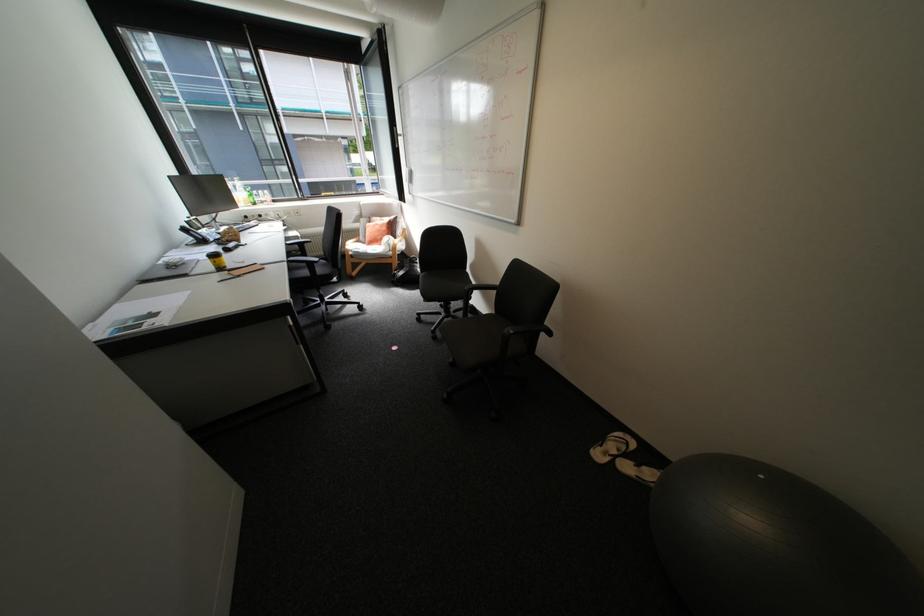
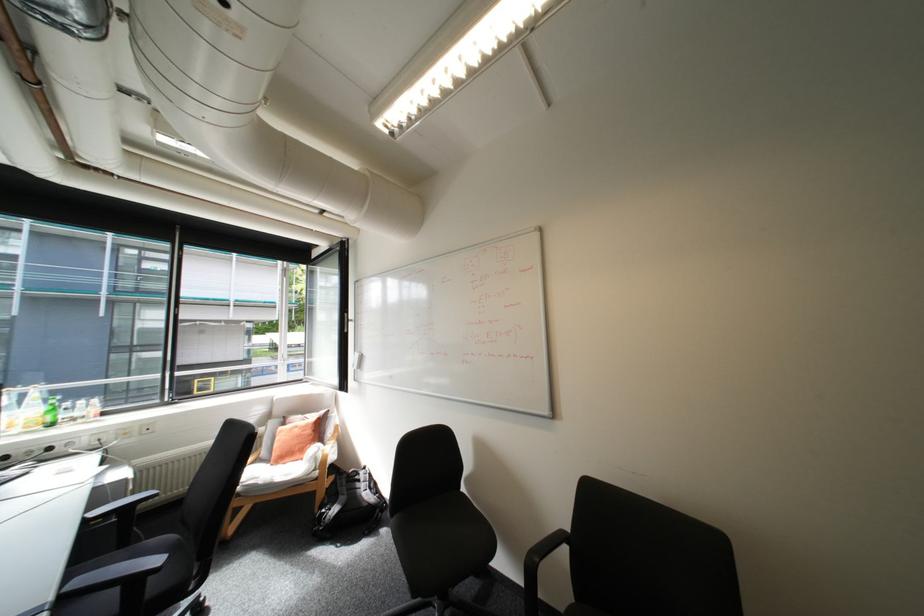
In the second image, find the point that corresponds to [257,193] in the first image.

(55, 408)